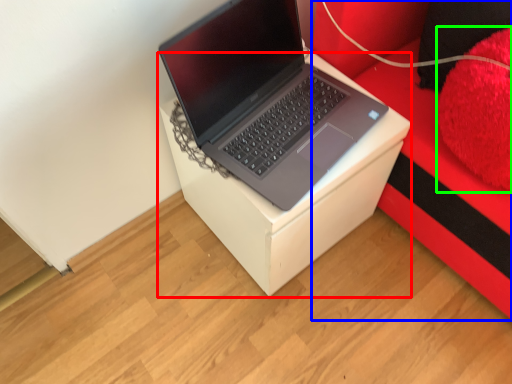
Question: Which object is the farthest from table (highlighted by a red box)? Choose among these: furniture (highlighted by a blue box) or pillow (highlighted by a green box).

Choices:
 (A) furniture
 (B) pillow

Answer: (B)